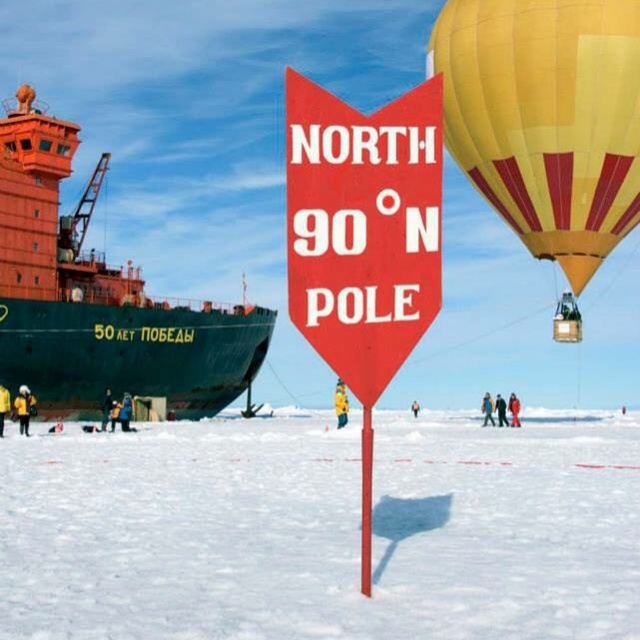
Between yellow fabric balloon at upper right and red plastic sign at center, which one appears on the left side from the viewer's perspective?

red plastic sign at center is more to the left.

Can you confirm if yellow fabric balloon at upper right is positioned below red plastic sign at center?

Indeed, yellow fabric balloon at upper right is positioned under red plastic sign at center.

Is point (564, 116) less distant than point (394, 189)?

That is False.

This screenshot has width=640, height=640. What are the coordinates of `yellow fabric balloon at upper right` in the screenshot? It's located at (545, 118).

Does white powdery snow at center appear under yellow fabric balloon at upper right?

Correct, white powdery snow at center is located below yellow fabric balloon at upper right.

In the scene shown: Does white powdery snow at center appear over yellow fabric balloon at upper right?

Actually, white powdery snow at center is below yellow fabric balloon at upper right.

The width and height of the screenshot is (640, 640). Identify the location of white powdery snow at center. (321, 531).

Identify the location of white powdery snow at center. (321, 531).

Who is more distant from viewer, (536,227) or (83,332)?

Positioned behind is point (83,332).

Does point (628, 32) lie in front of point (13, 300)?

Yes, point (628, 32) is in front of point (13, 300).

This screenshot has width=640, height=640. I want to click on yellow fabric balloon at upper right, so click(x=545, y=118).